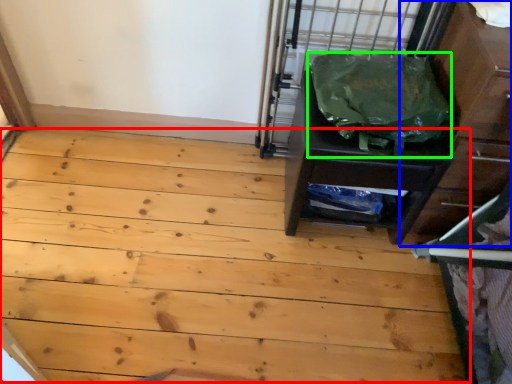
Question: Which object is the closest to the plywood (highlighted by a red box)? Choose among these: dresser (highlighted by a blue box) or garbage (highlighted by a green box).

Choices:
 (A) dresser
 (B) garbage

Answer: (B)